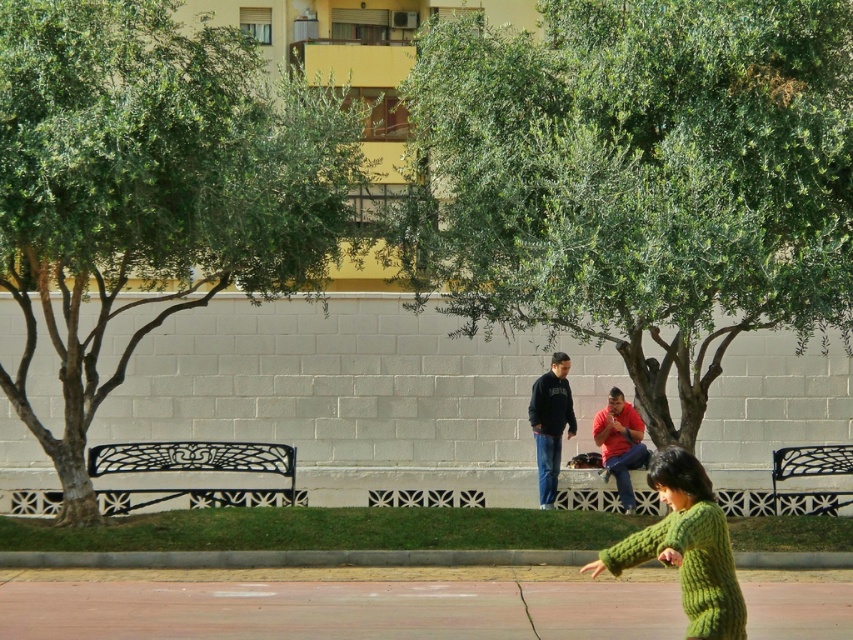
Find the location of a particular element. green leafy tree at left is located at coordinates (152, 188).

Who is positioned more to the left, green leafy tree at left or dark blue sweatshirt at center?

green leafy tree at left

What are the coordinates of `green leafy tree at left` in the screenshot? It's located at (152, 188).

Does white wrought iron bench at lower left have a smaller size compared to black wrought iron bench at center?

No.

From the picture: Does white wrought iron bench at lower left come in front of black wrought iron bench at center?

Yes.

The height and width of the screenshot is (640, 853). Describe the element at coordinates (194, 458) in the screenshot. I see `white wrought iron bench at lower left` at that location.

Locate an element on the screen. white wrought iron bench at lower left is located at coordinates (194, 458).

Which is below, green leafy tree at center or black wrought iron bench at center?

black wrought iron bench at center is lower down.

Is green leafy tree at center to the left of black wrought iron bench at center from the viewer's perspective?

Correct, you'll find green leafy tree at center to the left of black wrought iron bench at center.

What do you see at coordinates (635, 180) in the screenshot?
I see `green leafy tree at center` at bounding box center [635, 180].

Find the location of a particular element. This screenshot has width=853, height=640. green leafy tree at center is located at coordinates (635, 180).